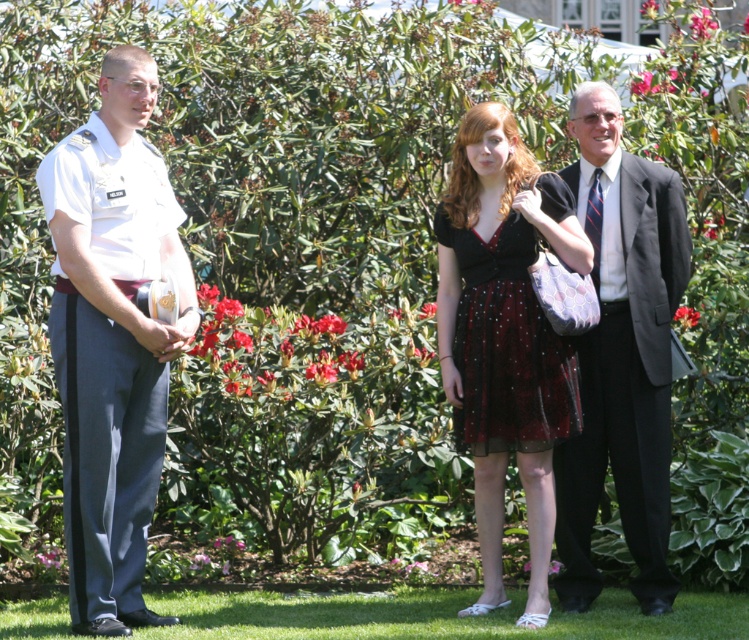
Describe the element at coordinates (506, 336) in the screenshot. The image size is (749, 640). I see `velvet dress at center` at that location.

Between velvet dress at center and black sheer dress at center, which one appears on the left side from the viewer's perspective?

From the viewer's perspective, black sheer dress at center appears more on the left side.

What do you see at coordinates (506, 336) in the screenshot?
I see `velvet dress at center` at bounding box center [506, 336].

Where is `velvet dress at center`? This screenshot has height=640, width=749. velvet dress at center is located at coordinates 506,336.

Is point (479, 464) in front of point (592, 518)?

That is True.

Is velvet dress at center positioned behind dark gray suit at center?

That is False.

Where is `velvet dress at center`? The image size is (749, 640). velvet dress at center is located at coordinates (506, 336).

Does point (94, 124) come closer to viewer compared to point (515, 236)?

Yes, it is in front of point (515, 236).

Find the location of a particular element. This screenshot has width=749, height=640. white uniform at left is located at coordinates (112, 339).

You are a GUI agent. You are given a task and a screenshot of the screen. Output one action in this format:
    pyautogui.click(x=<x>, y=<y>)
    Task: Click on the white uniform at left
    The width and height of the screenshot is (749, 640).
    Given the screenshot: What is the action you would take?
    pyautogui.click(x=112, y=339)